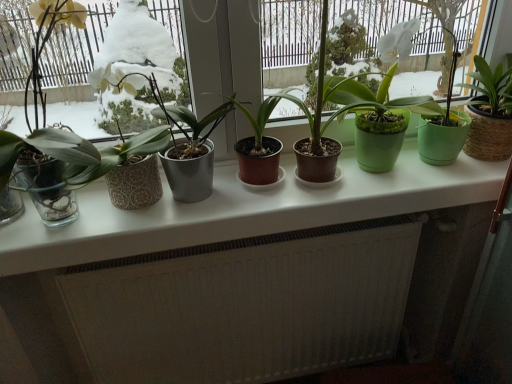
Question: From a real-world perspective, is transparent glass window at left over matte black pot at center, the second houseplant viewed from the right?

Choices:
 (A) yes
 (B) no

Answer: (A)

Question: Is matte black pot at center, the 3th houseplant viewed from the left, completely or partially inside transparent glass window at left?

Choices:
 (A) yes
 (B) no

Answer: (A)

Question: Is transparent glass window at left facing towards matte black pot at center, the second houseplant viewed from the right?

Choices:
 (A) no
 (B) yes

Answer: (A)

Question: Is transparent glass window at left thinner than matte black pot at center, the 3th houseplant viewed from the left?

Choices:
 (A) yes
 (B) no

Answer: (B)

Question: Is transparent glass window at left next to matte black pot at center, the 3th houseplant viewed from the left, and touching it?

Choices:
 (A) yes
 (B) no

Answer: (B)

Question: Looking at the image, does white textured radiator at lower center seem bigger or smaller compared to transparent glass window at left?

Choices:
 (A) small
 (B) big

Answer: (B)

Question: Based on their positions, is white textured radiator at lower center located to the left or right of transparent glass window at left?

Choices:
 (A) left
 (B) right

Answer: (B)

Question: Does point (259, 367) appear closer or farther from the camera than point (174, 52)?

Choices:
 (A) closer
 (B) farther

Answer: (A)

Question: From the image's perspective, is white textured radiator at lower center positioned above or below transparent glass window at left?

Choices:
 (A) above
 (B) below

Answer: (B)

Question: From the image's perspective, relative to white glossy counter top at center, is transparent glass window at left above or below?

Choices:
 (A) below
 (B) above

Answer: (B)

Question: Is transparent glass window at left spatially inside white glossy counter top at center, or outside of it?

Choices:
 (A) outside
 (B) inside

Answer: (A)

Question: Relative to white glossy counter top at center, is transparent glass window at left in front or behind?

Choices:
 (A) front
 (B) behind

Answer: (A)

Question: Is transparent glass window at left wider or thinner than white glossy counter top at center?

Choices:
 (A) wide
 (B) thin

Answer: (A)

Question: In terms of height, does white glossy counter top at center look taller or shorter compared to metallic gray pot at center, arranged as the first houseplant when viewed from the left?

Choices:
 (A) tall
 (B) short

Answer: (B)

Question: From the image's perspective, is white glossy counter top at center positioned above or below metallic gray pot at center, which is the 4th houseplant in right-to-left order?

Choices:
 (A) below
 (B) above

Answer: (A)